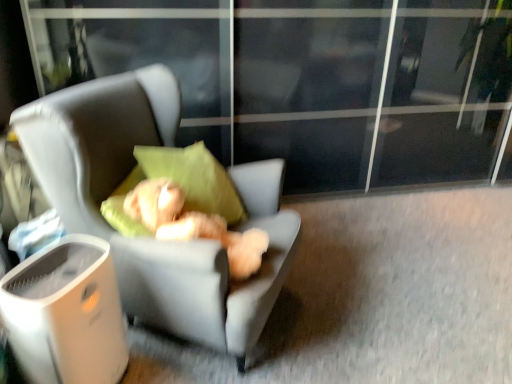
Question: Is white plastic trash bin at lower left shorter than soft gray fabric chair at center?

Choices:
 (A) no
 (B) yes

Answer: (B)

Question: Is white plastic trash bin at lower left further to camera compared to soft gray fabric chair at center?

Choices:
 (A) no
 (B) yes

Answer: (B)

Question: Is soft gray fabric chair at center inside white plastic trash bin at lower left?

Choices:
 (A) no
 (B) yes

Answer: (A)

Question: Is white plastic trash bin at lower left taller than soft gray fabric chair at center?

Choices:
 (A) no
 (B) yes

Answer: (A)

Question: Does white plastic trash bin at lower left have a lesser width compared to soft gray fabric chair at center?

Choices:
 (A) yes
 (B) no

Answer: (A)

Question: From their relative heights in the image, would you say transparent glass screen door at upper center is taller or shorter than white plastic trash bin at lower left?

Choices:
 (A) tall
 (B) short

Answer: (A)

Question: Relative to white plastic trash bin at lower left, is transparent glass screen door at upper center in front or behind?

Choices:
 (A) front
 (B) behind

Answer: (B)

Question: In terms of width, does transparent glass screen door at upper center look wider or thinner when compared to white plastic trash bin at lower left?

Choices:
 (A) thin
 (B) wide

Answer: (B)

Question: Is point (231, 72) closer or farther from the camera than point (10, 339)?

Choices:
 (A) closer
 (B) farther

Answer: (B)

Question: From the image's perspective, relative to white plastic trash bin at lower left, is fluffy beige teddy bear at center above or below?

Choices:
 (A) below
 (B) above

Answer: (B)

Question: In terms of size, does fluffy beige teddy bear at center appear bigger or smaller than white plastic trash bin at lower left?

Choices:
 (A) big
 (B) small

Answer: (B)

Question: From their relative heights in the image, would you say fluffy beige teddy bear at center is taller or shorter than white plastic trash bin at lower left?

Choices:
 (A) tall
 (B) short

Answer: (B)

Question: Does point (130, 215) appear closer or farther from the camera than point (48, 379)?

Choices:
 (A) closer
 (B) farther

Answer: (B)

Question: Is point (256, 183) positioned closer to the camera than point (124, 206)?

Choices:
 (A) farther
 (B) closer

Answer: (A)

Question: In terms of size, does soft gray fabric chair at center appear bigger or smaller than fluffy beige teddy bear at center?

Choices:
 (A) big
 (B) small

Answer: (A)